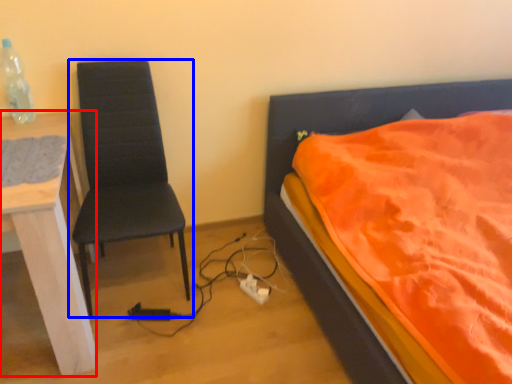
Question: Which point is closer to the camera, desk (highlighted by a red box) or chair (highlighted by a blue box)?

Choices:
 (A) desk
 (B) chair

Answer: (A)